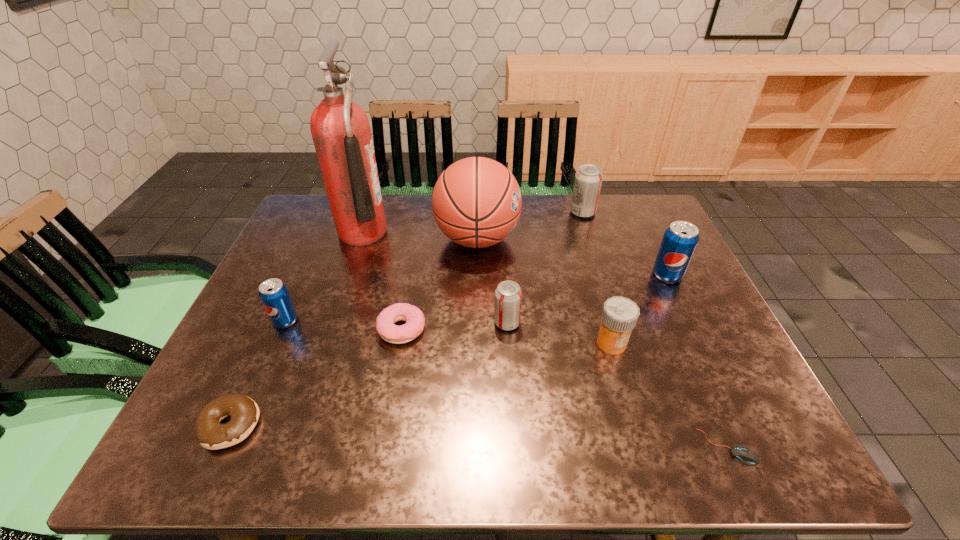
The image size is (960, 540). What are the coordinates of `basketball that is at the far edge` in the screenshot? It's located at (476, 202).

Where is `soda can that is at the far edge`? The image size is (960, 540). soda can that is at the far edge is located at coordinates (588, 180).

Image resolution: width=960 pixels, height=540 pixels. Identify the location of doughnut at the near edge. (244, 412).

Image resolution: width=960 pixels, height=540 pixels. I want to click on mouse that is at the near edge, so click(x=746, y=455).

Locate an element on the screen. fire extinguisher located in the left edge section of the desktop is located at coordinates (x=340, y=128).

The width and height of the screenshot is (960, 540). I want to click on pop soda that is at the left edge, so click(274, 295).

What are the coordinates of `doughnut that is positioned at the left edge` in the screenshot? It's located at (244, 412).

Image resolution: width=960 pixels, height=540 pixels. What are the coordinates of `pop soda present at the right edge` in the screenshot? It's located at (680, 239).

The height and width of the screenshot is (540, 960). In order to click on mouse that is at the right edge in this screenshot , I will do `click(746, 455)`.

This screenshot has width=960, height=540. I want to click on object that is at the far left corner, so click(x=340, y=128).